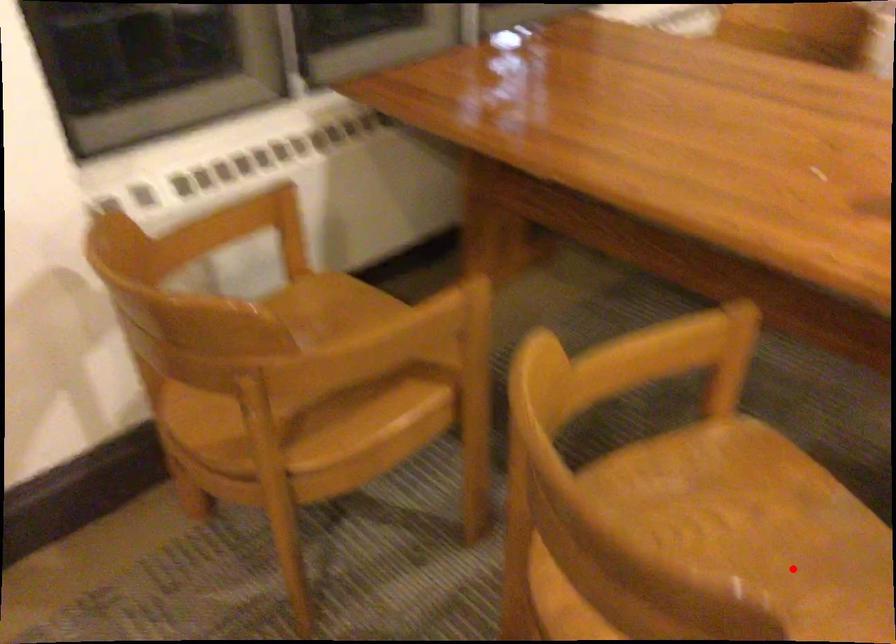
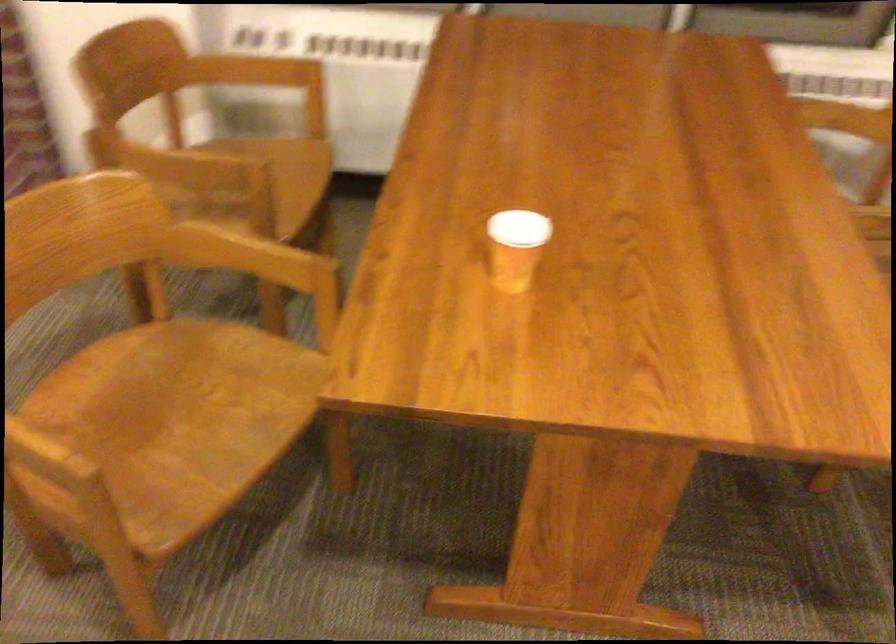
The point at the highlighted location is marked in the first image. Where is the corresponding point in the second image?

(170, 424)